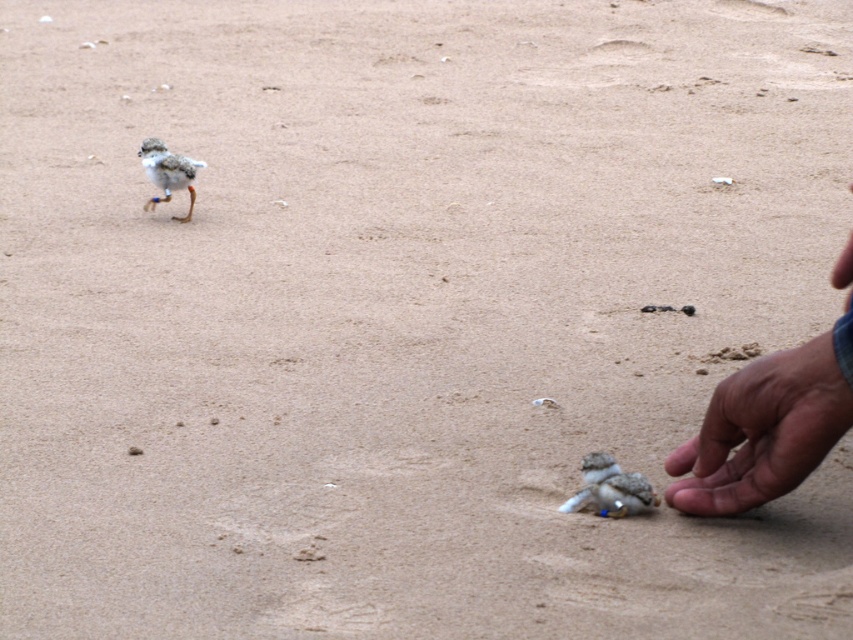
Is point (587, 477) positioned behind point (146, 163)?

That is False.

Can you confirm if speckled feathered bird at lower center is shorter than speckled feathered bird at upper left?

Yes, speckled feathered bird at lower center is shorter than speckled feathered bird at upper left.

Between point (608, 476) and point (175, 180), which one is positioned behind?

Positioned behind is point (175, 180).

This screenshot has height=640, width=853. I want to click on speckled feathered bird at lower center, so click(610, 488).

What do you see at coordinates (762, 432) in the screenshot?
I see `brown skin at lower right` at bounding box center [762, 432].

Consider the image. Does brown skin at lower right have a lesser height compared to speckled feathered bird at upper left?

No.

Who is more distant from viewer, (805, 372) or (148, 204)?

The point (148, 204) is behind.

Locate an element on the screen. brown skin at lower right is located at coordinates (762, 432).

Can you confirm if brown skin at lower right is thinner than speckled feathered bird at lower center?

No.

Who is more forward, (714, 456) or (643, 506)?

Point (714, 456)

Which is behind, point (704, 509) or point (590, 499)?

Point (590, 499)

I want to click on brown skin at lower right, so click(x=762, y=432).